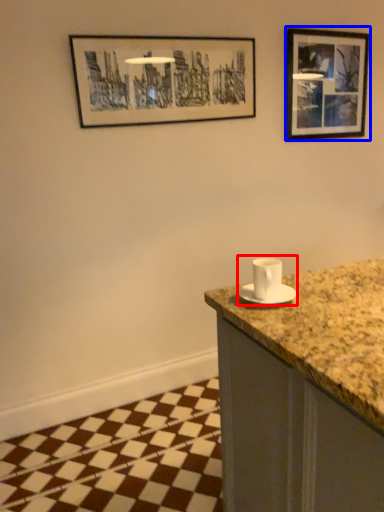
Question: Which object is further to the camera taking this photo, sink (highlighted by a red box) or picture frame (highlighted by a blue box)?

Choices:
 (A) sink
 (B) picture frame

Answer: (B)